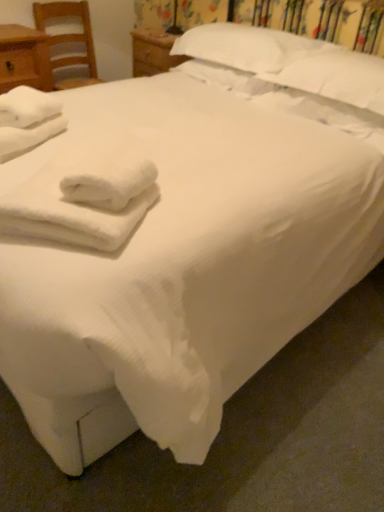
Question: Is white fluffy towels at lower left, which is the 1th bath towel from right to left, inside the boundaries of white soft towel at left, the second bath towel positioned from the front, or outside?

Choices:
 (A) outside
 (B) inside

Answer: (A)

Question: Considering the positions of point (51, 230) and point (16, 137), is point (51, 230) closer or farther from the camera than point (16, 137)?

Choices:
 (A) farther
 (B) closer

Answer: (B)

Question: Which of these objects is positioned farthest from the wooden chair at left?

Choices:
 (A) white fluffy towels at lower left, which is the second bath towel in left-to-right order
 (B) white soft pillow at upper center, the first pillow positioned from the left
 (C) white soft pillow at upper center, placed as the 2th pillow when sorted from left to right
 (D) white soft towel at left, which ranks as the first bath towel in left-to-right order
 (E) matte wood nightstand at left

Answer: (A)

Question: Based on their relative distances, which object is farther from the white soft towel at left, the second bath towel positioned from the front?

Choices:
 (A) wooden chair at left
 (B) matte wood nightstand at left
 (C) white soft pillow at upper center, marked as the first pillow in a right-to-left arrangement
 (D) white fluffy towels at lower left, placed as the second bath towel when sorted from top to bottom
 (E) white soft pillow at upper center, the 2th pillow positioned from the right

Answer: (A)